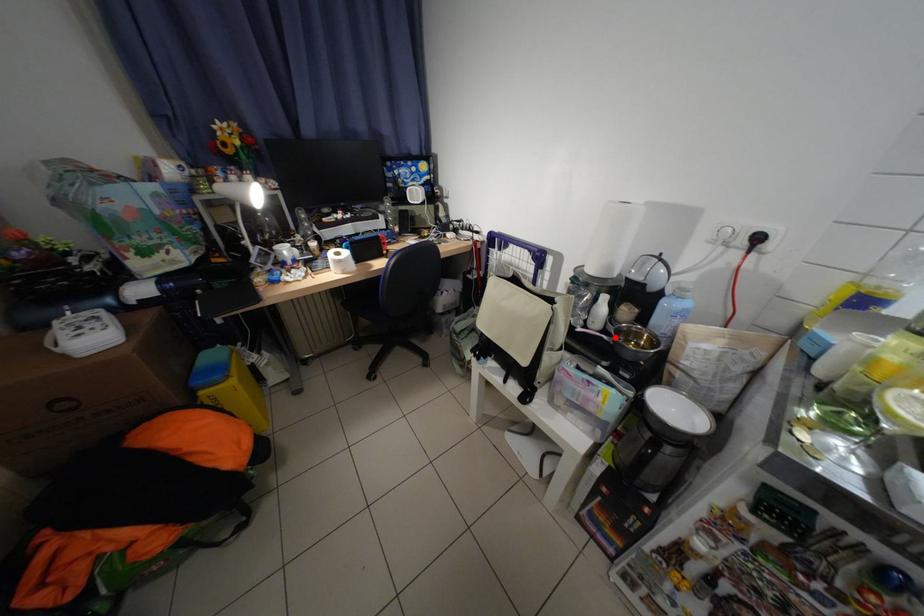
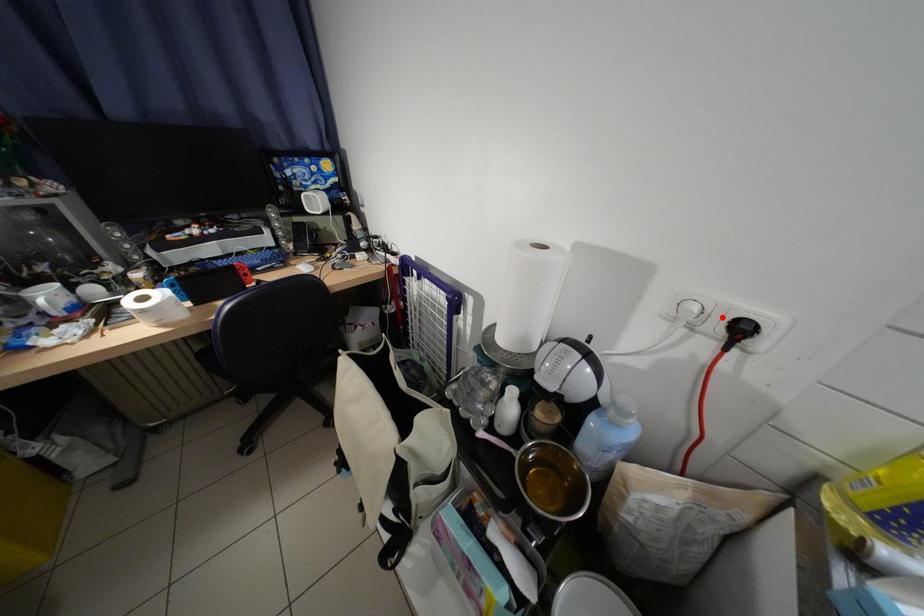
I am providing you with two images of the same scene from different viewpoints. A red point is marked on the first image and another point is marked on the second image. Do the highlighted points in image1 and image2 indicate the same real-world spot?

No